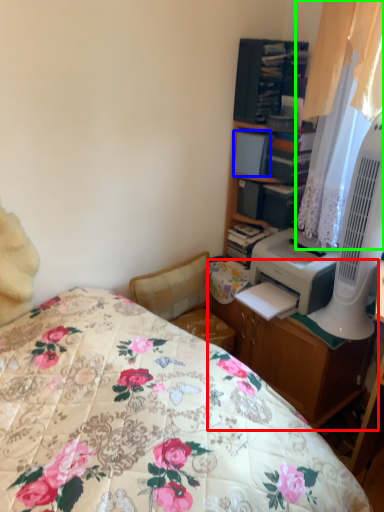
Question: Considering the real-world distances, which object is farthest from desk (highlighted by a red box)? book (highlighted by a blue box) or curtain (highlighted by a green box)?

Choices:
 (A) book
 (B) curtain

Answer: (A)